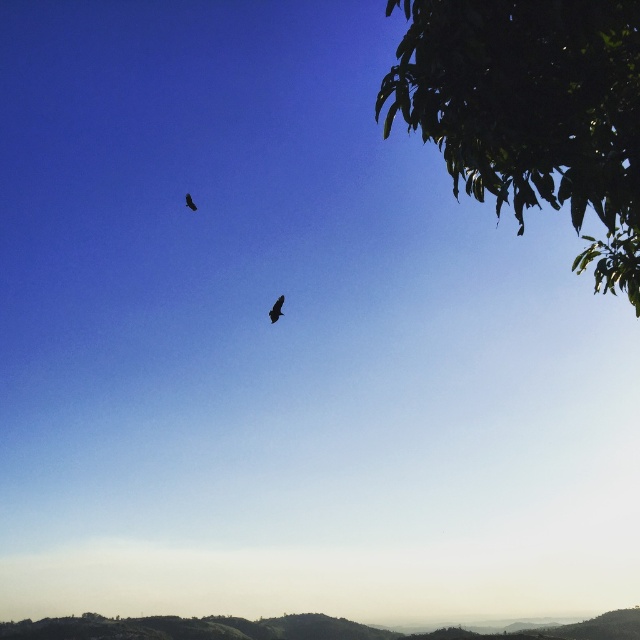
Question: From the image, what is the correct spatial relationship of green leafy tree at upper right in relation to dark brown feathered bird at upper center?

Choices:
 (A) above
 (B) below

Answer: (A)

Question: Estimate the real-world distances between objects in this image. Which object is closer to the dark brown feathers at center?

Choices:
 (A) dark brown feathered bird at upper center
 (B) green leafy tree at upper right

Answer: (B)

Question: Which object is the farthest from the dark brown feathers at center?

Choices:
 (A) green leafy tree at upper right
 (B) dark brown feathered bird at upper center

Answer: (B)

Question: Does green leafy tree at upper right have a greater width compared to dark brown feathers at center?

Choices:
 (A) yes
 (B) no

Answer: (A)

Question: Which of the following is the closest to the observer?

Choices:
 (A) (419, 76)
 (B) (280, 300)
 (C) (186, 205)

Answer: (A)

Question: Where is dark brown feathers at center located in relation to dark brown feathered bird at upper center in the image?

Choices:
 (A) right
 (B) left

Answer: (A)